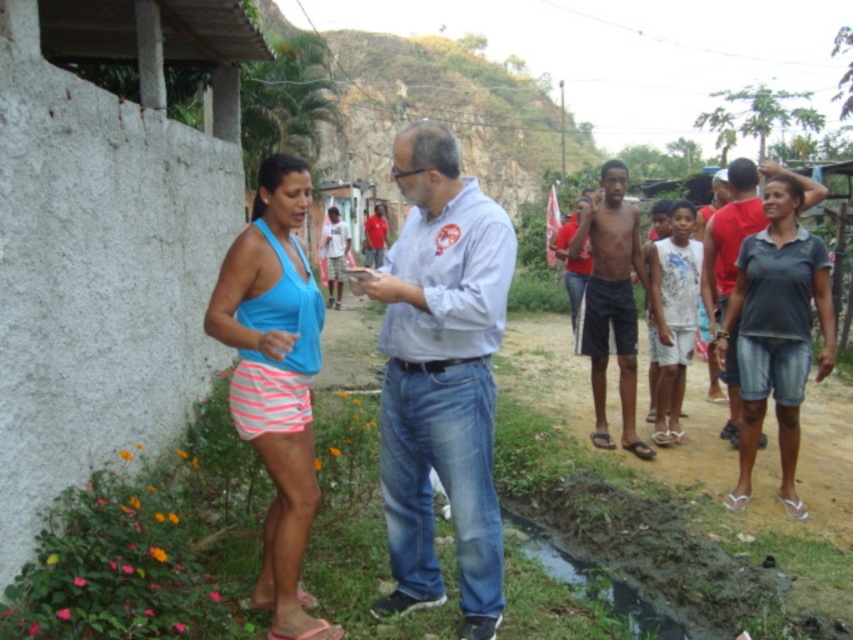
Is matte blue tank top at center to the right of dark skin/smooth skin man at center from the viewer's perspective?

No, matte blue tank top at center is not to the right of dark skin/smooth skin man at center.

From the picture: Is matte blue tank top at center taller than dark skin/smooth skin man at center?

Indeed, matte blue tank top at center has a greater height compared to dark skin/smooth skin man at center.

What do you see at coordinates (276, 372) in the screenshot? I see `matte blue tank top at center` at bounding box center [276, 372].

Where is `matte blue tank top at center`? matte blue tank top at center is located at coordinates (276, 372).

Between dark skin/smooth skin man at center and dark gray t-shirt at right, which one has more height?

With more height is dark gray t-shirt at right.

Who is more distant from viewer, (625, 248) or (718, 316)?

The point (625, 248) is more distant.

I want to click on dark skin/smooth skin man at center, so click(x=611, y=301).

Find the location of a particular element. The image size is (853, 640). dark gray denim shorts at right is located at coordinates (776, 332).

Is dark gray denim shorts at right shorter than pink fabric sandal at lower left?

In fact, dark gray denim shorts at right may be taller than pink fabric sandal at lower left.

You are a GUI agent. You are given a task and a screenshot of the screen. Output one action in this format:
    pyautogui.click(x=<x>, y=<y>)
    Task: Click on the dark gray denim shorts at right
    
    Given the screenshot: What is the action you would take?
    pyautogui.click(x=776, y=332)